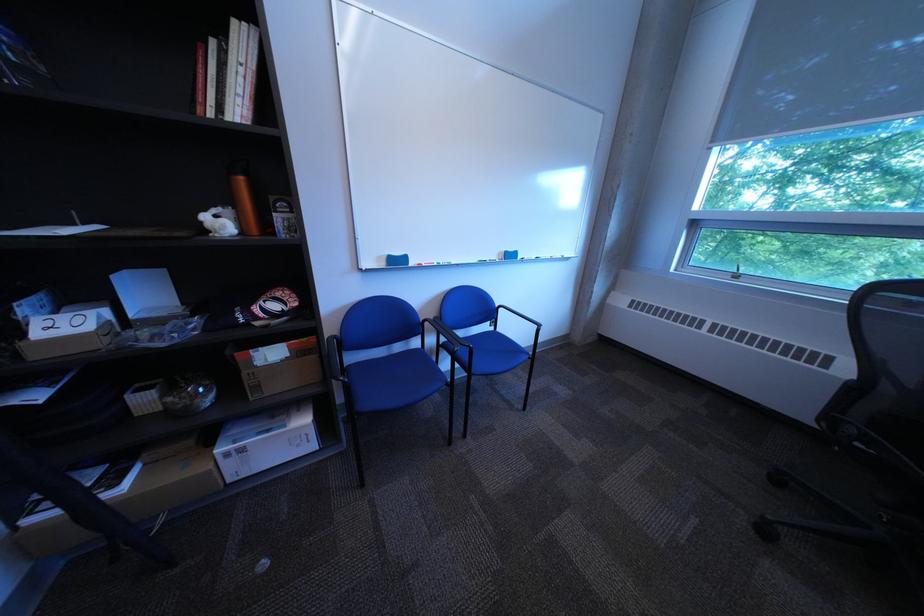
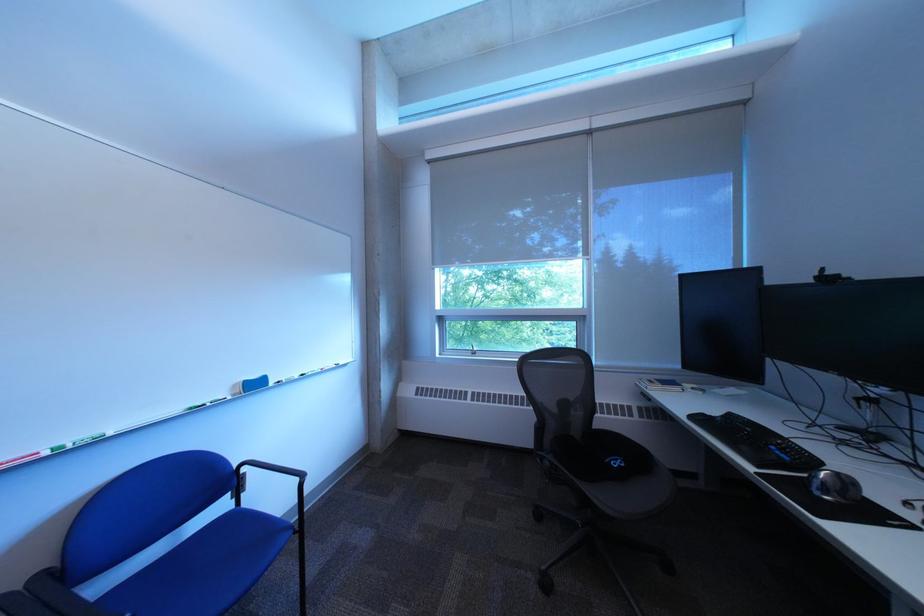
The point at [868,432] is marked in the first image. Where is the corresponding point in the second image?

(563, 464)